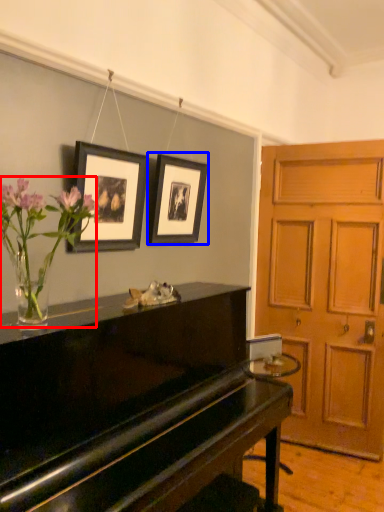
Question: Which object appears farthest to the camera in this image, floral arrangement (highlighted by a red box) or picture frame (highlighted by a blue box)?

Choices:
 (A) floral arrangement
 (B) picture frame

Answer: (B)